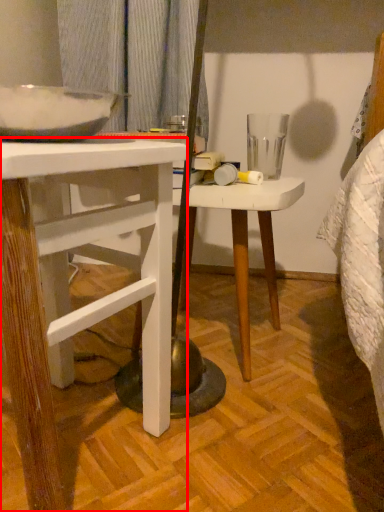
Question: From the image's perspective, where is desk (annotated by the red box) located in relation to stool in the image?

Choices:
 (A) above
 (B) below

Answer: (B)